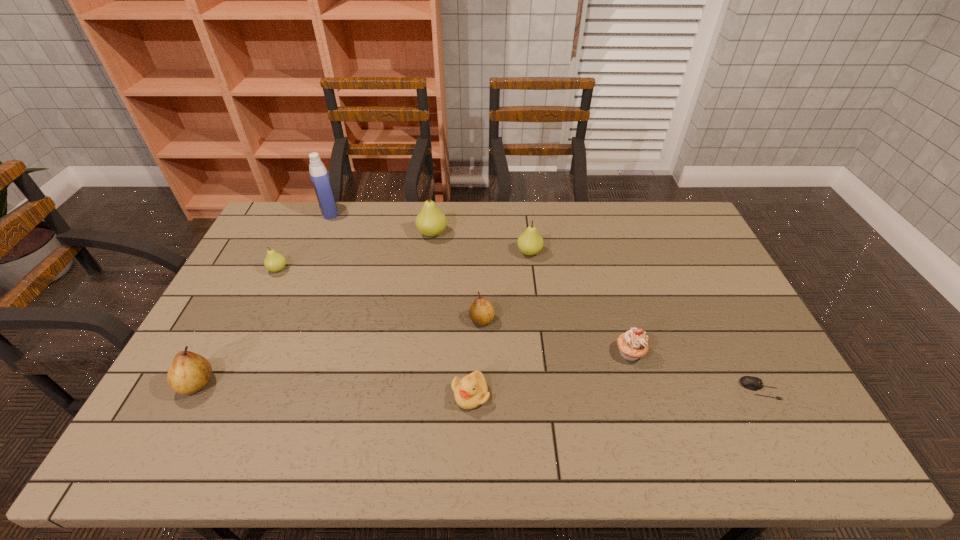
This screenshot has width=960, height=540. I want to click on vacant space located 0.330m on the front of the rightmost pear, so click(x=540, y=338).

Locate an element on the screen. This screenshot has width=960, height=540. free space located 0.220m on the right of the bigger brown pear is located at coordinates (300, 383).

Where is `free region located on the back of the leftmost green pear`? free region located on the back of the leftmost green pear is located at coordinates (304, 215).

Find the location of a particular element. This screenshot has height=540, width=960. vacant area situated 0.060m on the left of the smaller brown pear is located at coordinates (449, 320).

Image resolution: width=960 pixels, height=540 pixels. Find the location of `vacant area situated 0.070m on the left of the fourth nearest object`. vacant area situated 0.070m on the left of the fourth nearest object is located at coordinates (589, 353).

Where is `vacant point located 0.110m on the beak of the duckling`? The width and height of the screenshot is (960, 540). vacant point located 0.110m on the beak of the duckling is located at coordinates (469, 455).

Where is `vacant space located 0.270m on the back of the rightmost object`? vacant space located 0.270m on the back of the rightmost object is located at coordinates (715, 303).

Locate an element on the screen. The width and height of the screenshot is (960, 540). detergent present at the far edge is located at coordinates (319, 175).

You are a GUI agent. You are given a task and a screenshot of the screen. Output one action in this format:
    pyautogui.click(x=<x>, y=<y>)
    Task: Click on the pear present at the far edge
    The height and width of the screenshot is (540, 960).
    Given the screenshot: What is the action you would take?
    pyautogui.click(x=431, y=221)

Locate an element on the screen. Image resolution: width=960 pixels, height=540 pixels. object that is at the right edge is located at coordinates (753, 383).